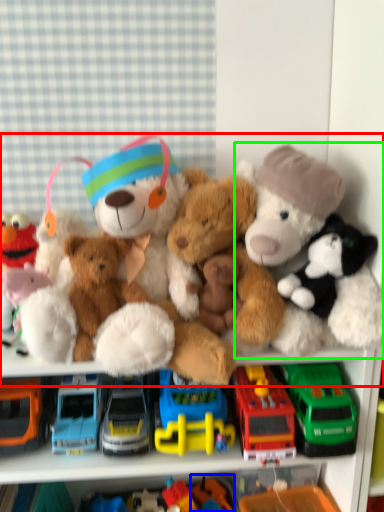
Question: Estimate the real-world distances between objects in this image. Which object is closer to teddy bear (highlighted by a red box), toy (highlighted by a blue box) or toy (highlighted by a green box)?

Choices:
 (A) toy
 (B) toy

Answer: (B)